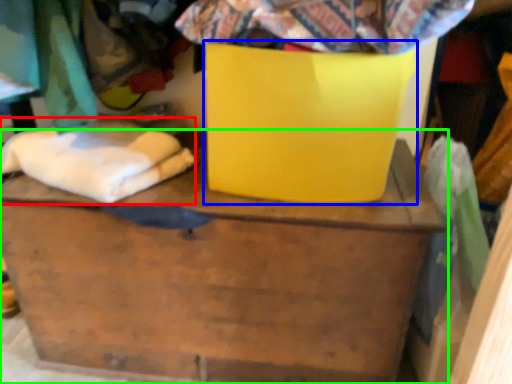
Question: Which is nearer to the linen (highlighted by a red box)? cardboard box (highlighted by a blue box) or furniture (highlighted by a green box).

Choices:
 (A) cardboard box
 (B) furniture

Answer: (B)